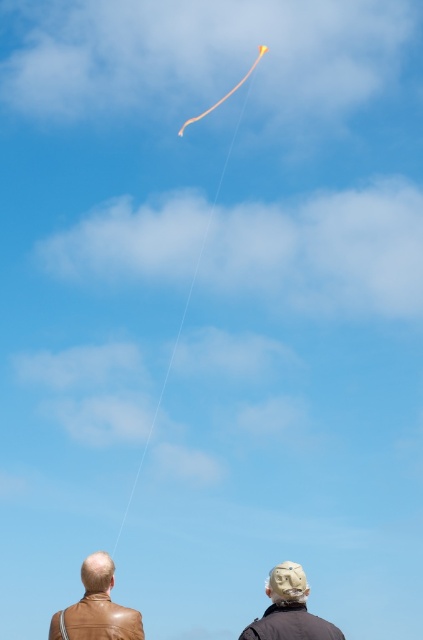
You are trying to determine the relative sizes of the objects in the scene. Which object is wider, the brown leather jacket at lower left or the yellow matte kite at upper center?

The yellow matte kite at upper center is wider than the brown leather jacket at lower left according to the description.

You are standing at the point labeled as point (96, 608). Which object is located at this coordinate?

The brown leather jacket at lower left is located at point (96, 608).